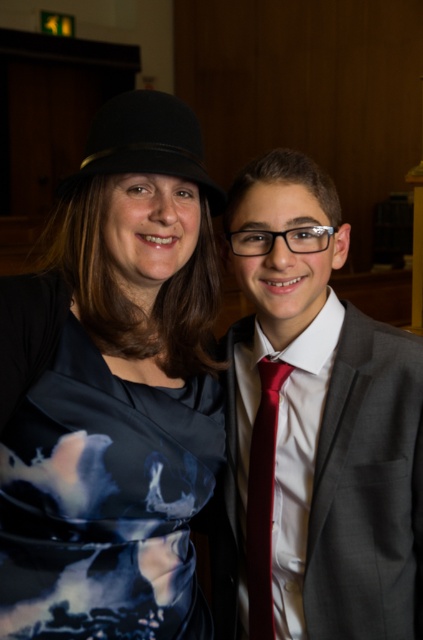
Looking at this image, you are a photographer adjusting the camera focus. The dark blue satin dress at center and the shiny red tie at center are both in the frame. Which object is closer to the camera?

The dark blue satin dress at center is 26.12 centimeters away from the shiny red tie at center, so the dress is closer to the camera since it is positioned in front of the tie.

You are a photographer setting up a shoot in a room with two subjects. The scene includes a matte gray suit at right and a dark blue satin dress at center. You need to position a spotlight so it illuminates both objects without casting shadows on the background. Given their spatial arrangement, which object should you place the spotlight closer to?

The dark blue satin dress at center is behind the matte gray suit at right. To illuminate both without casting shadows, the spotlight should be placed closer to the matte gray suit at right, as it is in front and will block light from reaching the dress if positioned too far back.